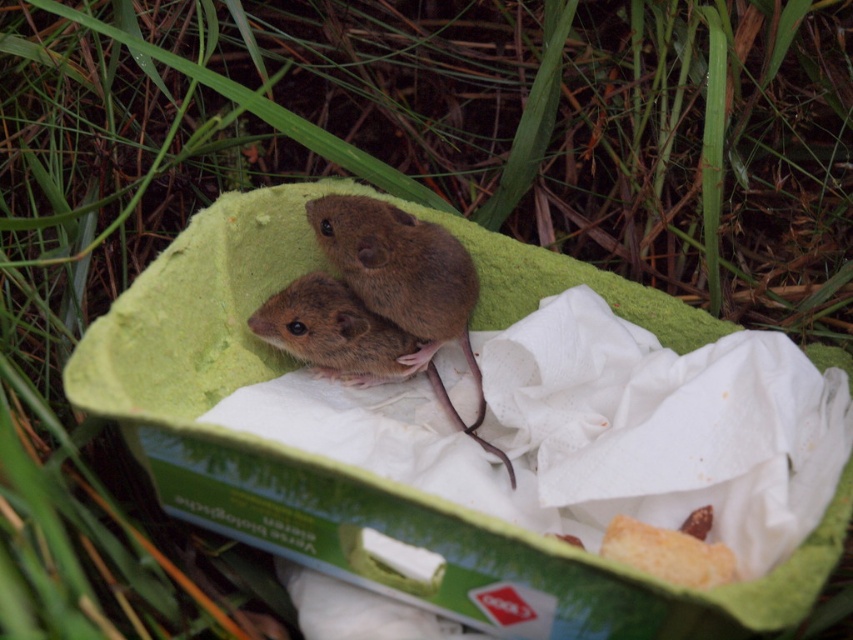
This screenshot has height=640, width=853. What are the coordinates of `brown furry hamster at center` in the screenshot? It's located at (405, 284).

Is brown furry hamster at center positioned before brown furry mouse at center?

Yes, it is in front of brown furry mouse at center.

Between point (363, 266) and point (334, 307), which one is positioned in front?

Positioned in front is point (363, 266).

In order to click on brown furry hamster at center in this screenshot , I will do `click(405, 284)`.